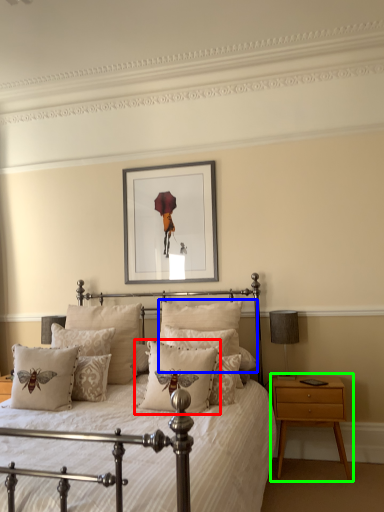
Question: Which object is the farthest from pillow (highlighted by a red box)? Choose among these: pillow (highlighted by a blue box) or nightstand (highlighted by a green box).

Choices:
 (A) pillow
 (B) nightstand

Answer: (B)